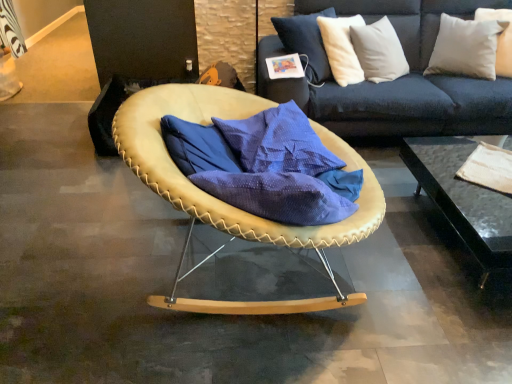
Question: Does white soft pillow at upper right, placed as the 2th pillow when sorted from left to right, lie behind white cotton pillow at upper right, arranged as the 2th pillow when viewed from the right?

Choices:
 (A) yes
 (B) no

Answer: (A)

Question: From the image's perspective, would you say white soft pillow at upper right, the 1th pillow viewed from the right, is shown under white cotton pillow at upper right, arranged as the 2th pillow when viewed from the right?

Choices:
 (A) yes
 (B) no

Answer: (B)

Question: Is white soft pillow at upper right, placed as the 2th pillow when sorted from left to right, completely or partially outside of white cotton pillow at upper right, arranged as the 2th pillow when viewed from the right?

Choices:
 (A) yes
 (B) no

Answer: (B)

Question: Is white soft pillow at upper right, the 1th pillow viewed from the right, directly adjacent to white cotton pillow at upper right, arranged as the first pillow when viewed from the left?

Choices:
 (A) no
 (B) yes

Answer: (A)

Question: Is white cotton pillow at upper right, arranged as the first pillow when viewed from the left, completely or partially inside white soft pillow at upper right, the 1th pillow viewed from the right?

Choices:
 (A) yes
 (B) no

Answer: (A)

Question: Is there a large distance between white soft pillow at upper right, placed as the 2th pillow when sorted from left to right, and white cotton pillow at upper right, arranged as the 2th pillow when viewed from the right?

Choices:
 (A) yes
 (B) no

Answer: (B)

Question: From a real-world perspective, is black glass table at lower right positioned over leather-like tan chair at center based on gravity?

Choices:
 (A) no
 (B) yes

Answer: (A)

Question: From the image's perspective, is black glass table at lower right located beneath leather-like tan chair at center?

Choices:
 (A) no
 (B) yes

Answer: (B)

Question: Considering the relative positions of black glass table at lower right and leather-like tan chair at center in the image provided, is black glass table at lower right to the left of leather-like tan chair at center from the viewer's perspective?

Choices:
 (A) yes
 (B) no

Answer: (B)

Question: From the image's perspective, does black glass table at lower right appear higher than leather-like tan chair at center?

Choices:
 (A) yes
 (B) no

Answer: (B)

Question: Does black glass table at lower right have a lesser height compared to leather-like tan chair at center?

Choices:
 (A) yes
 (B) no

Answer: (A)

Question: Does black glass table at lower right turn towards leather-like tan chair at center?

Choices:
 (A) no
 (B) yes

Answer: (A)

Question: Is black glass table at lower right thinner than white soft pillow at upper right, the 1th pillow viewed from the right?

Choices:
 (A) yes
 (B) no

Answer: (B)